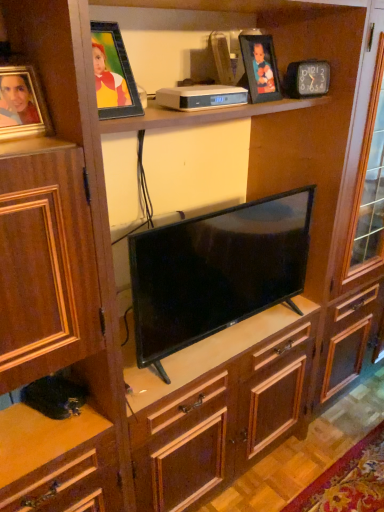
Question: Is black glossy tv at center oriented away from matte gold picture frame at left, the first picture frame from the bottom?

Choices:
 (A) yes
 (B) no

Answer: (B)

Question: Would you say black glossy tv at center contains matte gold picture frame at left, which ranks as the first picture frame in left-to-right order?

Choices:
 (A) no
 (B) yes

Answer: (A)

Question: From the image's perspective, is black glossy tv at center on matte gold picture frame at left, positioned as the second picture frame in back-to-front order?

Choices:
 (A) yes
 (B) no

Answer: (B)

Question: Is black glossy tv at center oriented towards matte gold picture frame at left, the first picture frame from the bottom?

Choices:
 (A) no
 (B) yes

Answer: (A)

Question: Does black glossy tv at center have a larger size compared to matte gold picture frame at left, positioned as the second picture frame in back-to-front order?

Choices:
 (A) no
 (B) yes

Answer: (B)

Question: Does point (281, 241) appear closer or farther from the camera than point (29, 67)?

Choices:
 (A) closer
 (B) farther

Answer: (B)

Question: Is black glossy tv at center inside or outside of matte gold picture frame at left, which is counted as the first picture frame, starting from the front?

Choices:
 (A) outside
 (B) inside

Answer: (A)

Question: Considering the positions of black glossy tv at center and matte gold picture frame at left, the first picture frame from the bottom, in the image, is black glossy tv at center taller or shorter than matte gold picture frame at left, the first picture frame from the bottom,?

Choices:
 (A) short
 (B) tall

Answer: (B)

Question: Based on their sizes in the image, would you say black glossy tv at center is bigger or smaller than matte gold picture frame at left, which ranks as the first picture frame in left-to-right order?

Choices:
 (A) big
 (B) small

Answer: (A)

Question: Visually, is matte black picture frame at upper center, arranged as the first picture frame when viewed from the top, positioned to the left or to the right of matte gold picture frame at left, which is counted as the first picture frame, starting from the front?

Choices:
 (A) left
 (B) right

Answer: (B)

Question: Considering the positions of matte black picture frame at upper center, positioned as the second picture frame in left-to-right order, and matte gold picture frame at left, which ranks as the first picture frame in left-to-right order, in the image, is matte black picture frame at upper center, positioned as the second picture frame in left-to-right order, wider or thinner than matte gold picture frame at left, which ranks as the first picture frame in left-to-right order,?

Choices:
 (A) thin
 (B) wide

Answer: (B)

Question: In the image, is matte black picture frame at upper center, marked as the 2th picture frame in a bottom-to-top arrangement, positioned in front of or behind matte gold picture frame at left, positioned as the second picture frame in back-to-front order?

Choices:
 (A) front
 (B) behind

Answer: (B)

Question: From a real-world perspective, is matte black picture frame at upper center, the second picture frame viewed from the front, above or below matte gold picture frame at left, the first picture frame from the bottom?

Choices:
 (A) below
 (B) above

Answer: (B)

Question: Considering the positions of matte black picture frame at upper center, which is the first picture frame in right-to-left order, and black glossy tv at center in the image, is matte black picture frame at upper center, which is the first picture frame in right-to-left order, bigger or smaller than black glossy tv at center?

Choices:
 (A) small
 (B) big

Answer: (A)

Question: From their relative heights in the image, would you say matte black picture frame at upper center, the second picture frame viewed from the front, is taller or shorter than black glossy tv at center?

Choices:
 (A) short
 (B) tall

Answer: (A)